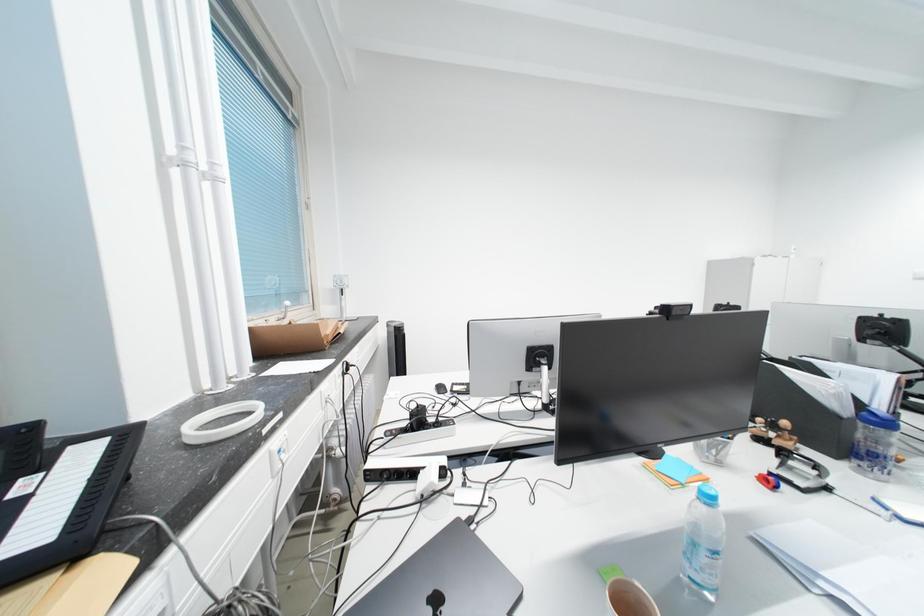
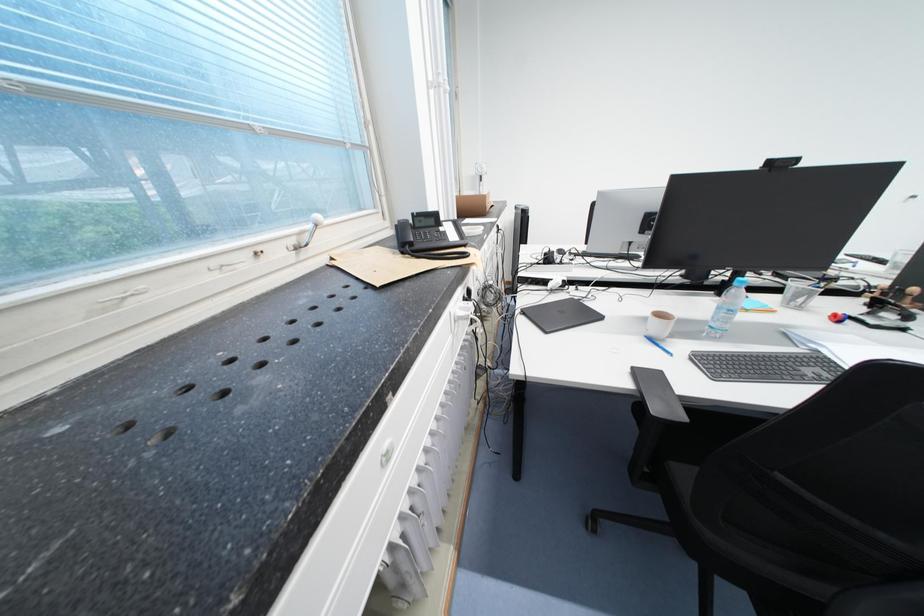
The images are taken continuously from a first-person perspective. In which direction is your viewpoint rotating?

The camera rotated toward left-down.